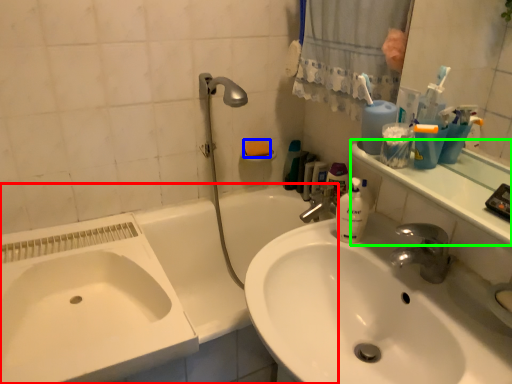
Question: Which object is positioned farthest from bathtub (highlighted by a red box)? Select from soap (highlighted by a blue box) and counter top (highlighted by a green box).

Choices:
 (A) soap
 (B) counter top

Answer: (B)